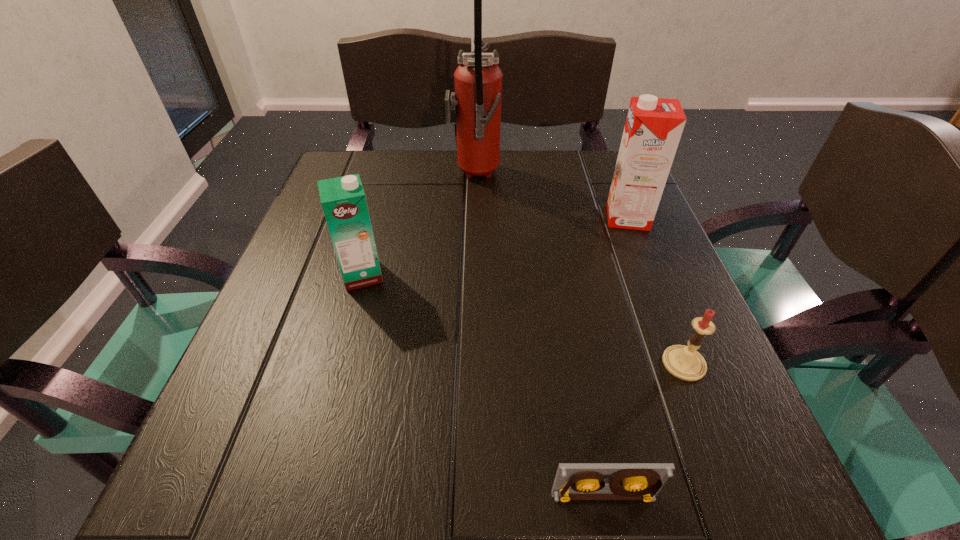
This screenshot has width=960, height=540. I want to click on the tallest object, so click(x=478, y=80).

At what (x,y) coordinates should I click in order to perform the action: click on fire extinguisher. Please return your answer as a coordinate pair (x, y). Looking at the image, I should click on (478, 80).

Locate an element on the screen. Image resolution: width=960 pixels, height=540 pixels. the taller carton is located at coordinates (653, 128).

Locate an element on the screen. The height and width of the screenshot is (540, 960). the right carton is located at coordinates (653, 128).

Identify the location of the leftmost object. (343, 200).

Where is `the left carton`? This screenshot has height=540, width=960. the left carton is located at coordinates (343, 200).

What are the coordinates of `the second nearest object` in the screenshot? It's located at (684, 362).

Where is `candle`? The height and width of the screenshot is (540, 960). candle is located at coordinates (684, 362).

Identify the location of videotape. (574, 481).

This screenshot has height=540, width=960. I want to click on the shortest object, so click(x=574, y=481).